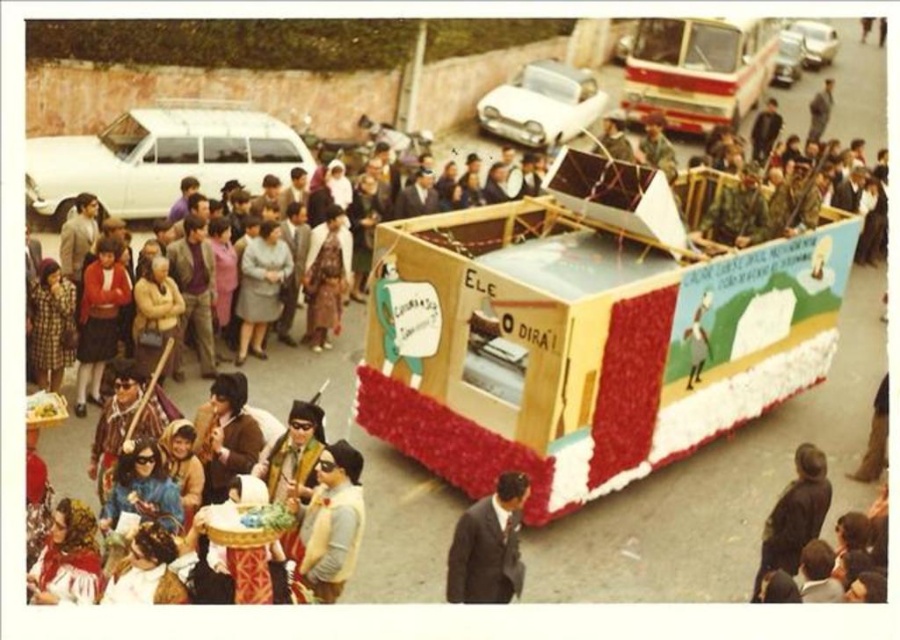
Question: Can you confirm if metallic silver bus at upper center is positioned to the left of light brown fabric hat at center?

Choices:
 (A) no
 (B) yes

Answer: (A)

Question: Among these points, which one is farthest from the camera?

Choices:
 (A) (464, 522)
 (B) (747, 40)
 (C) (351, 461)

Answer: (B)

Question: Is the position of metallic silver bus at upper center more distant than that of dark suit at center?

Choices:
 (A) yes
 (B) no

Answer: (A)

Question: From the image, what is the correct spatial relationship of wooden float at center in relation to metallic silver bus at upper center?

Choices:
 (A) above
 (B) below

Answer: (B)

Question: Which point appears farthest from the camera in this image?

Choices:
 (A) (320, 522)
 (B) (508, 534)
 (C) (540, 209)

Answer: (C)

Question: Among these objects, which one is farthest from the camera?

Choices:
 (A) dark brown leather jacket at lower right
 (B) metallic silver bus at upper center
 (C) dark suit at center
 (D) wooden float at center

Answer: (B)